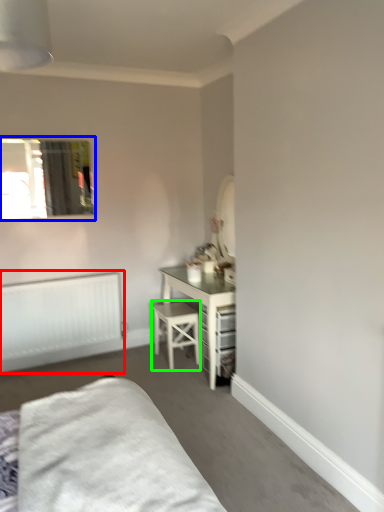
Question: Considering the real-world distances, which object is farthest from radiator (highlighted by a red box)? window (highlighted by a blue box) or stool (highlighted by a green box)?

Choices:
 (A) window
 (B) stool

Answer: (A)